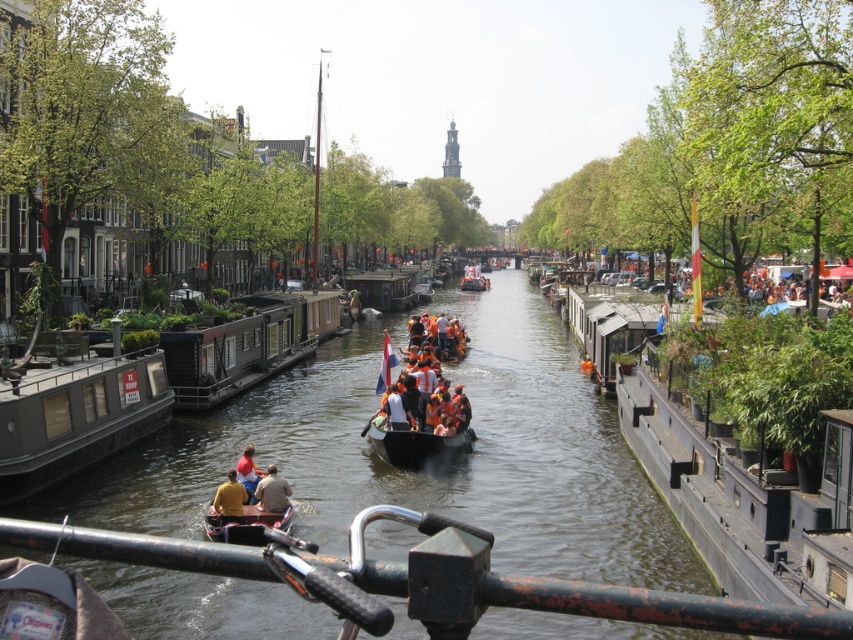
You are a tourist standing on the canal bridge and see the orange life jackets at center and the wooden boat at center. Which object is located to the right of the other?

The orange life jackets at center are positioned on the right side of the wooden boat at center.

You are a tourist standing on the bridge above the canal. You see the dark gray matte houseboat at left and the wooden boat at center. Which boat is closer to the bridge where you are standing?

The dark gray matte houseboat at left is closer to the bridge where you are standing because it is positioned to the left of the wooden boat at center, which is further away from the bridge.